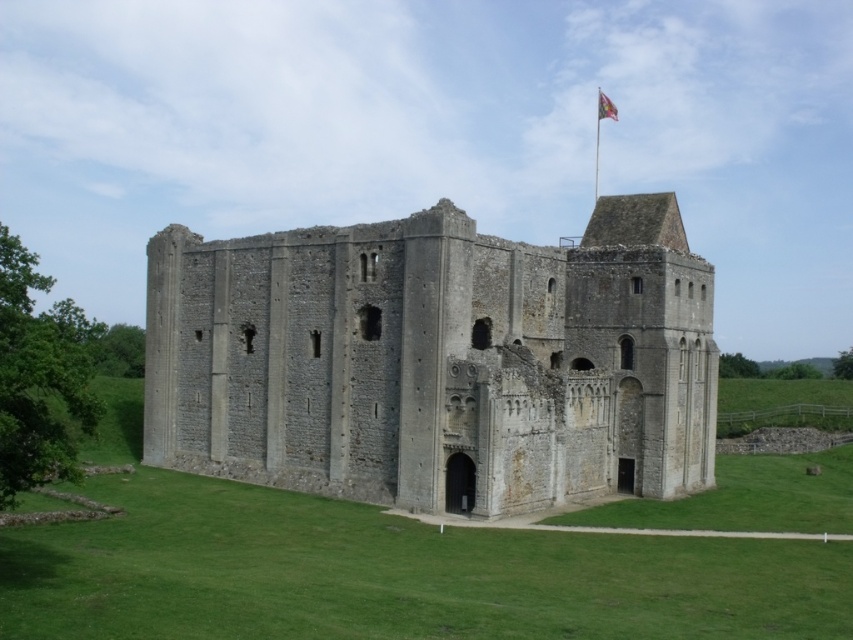
Question: From the image, what is the correct spatial relationship of gray stone castle at center in relation to silky fabric flag at upper right?

Choices:
 (A) above
 (B) below

Answer: (B)

Question: Which of the following is the closest to the observer?

Choices:
 (A) (610, 102)
 (B) (548, 333)

Answer: (B)

Question: Does gray stone castle at center come in front of silky fabric flag at upper right?

Choices:
 (A) yes
 (B) no

Answer: (A)

Question: Which point is closer to the camera taking this photo?

Choices:
 (A) (619, 436)
 (B) (601, 104)

Answer: (A)

Question: Which object appears closest to the camera in this image?

Choices:
 (A) silky fabric flag at upper right
 (B) gray stone castle at center

Answer: (B)

Question: Does gray stone castle at center have a larger size compared to silky fabric flag at upper right?

Choices:
 (A) yes
 (B) no

Answer: (A)